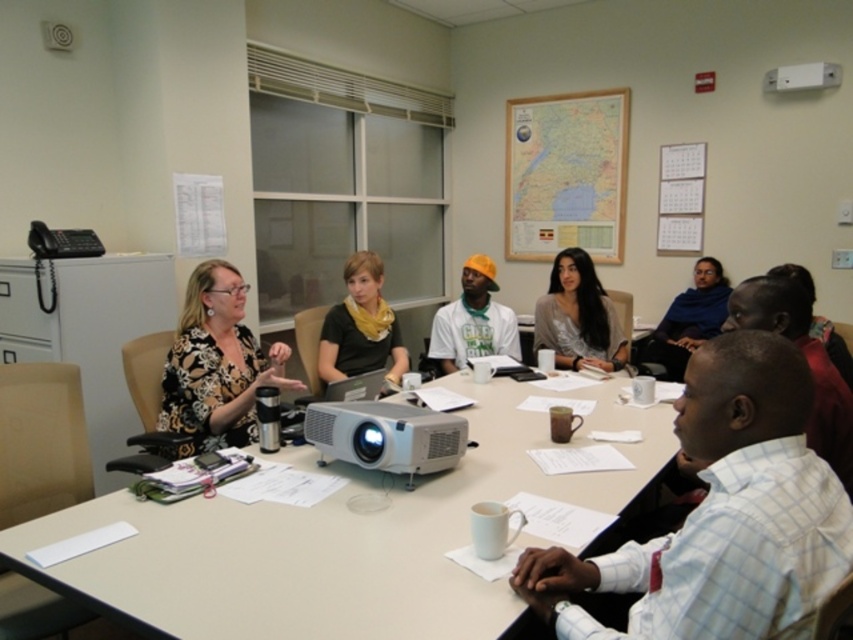
You are sitting at the conference table and need to pass a document to the person at point [236,333]. There is an obstacle at point [386,520]. Can you reach them without moving around the obstacle?

Point [386,520] is in front of point [236,333], so you cannot reach them without moving around the obstacle at point [386,520].